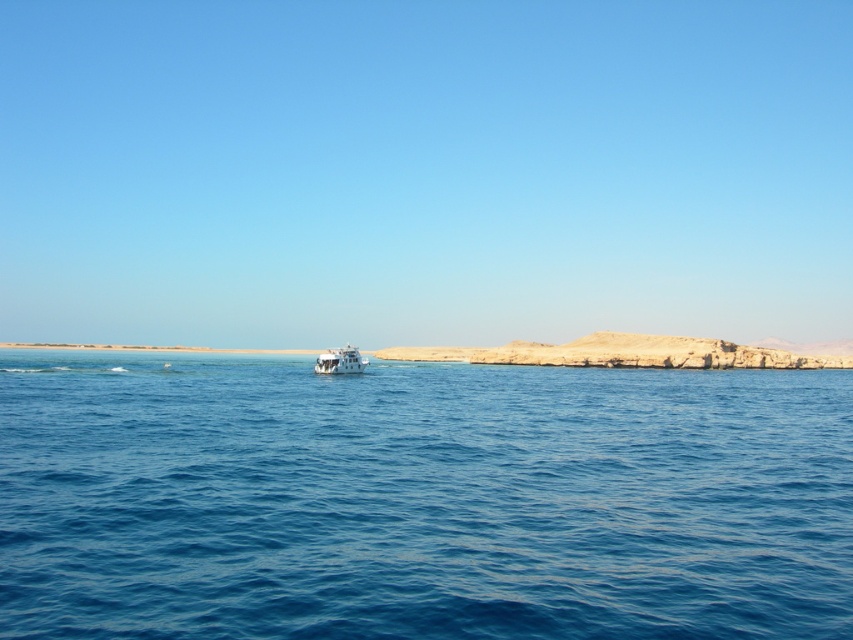
Question: Can you confirm if white rocky coast at center is bigger than white glossy boat at center?

Choices:
 (A) no
 (B) yes

Answer: (B)

Question: Based on their relative distances, which object is farther from the blue water at center?

Choices:
 (A) white glossy boat at center
 (B) white rocky coast at center

Answer: (B)

Question: Is white rocky coast at center smaller than white glossy boat at center?

Choices:
 (A) no
 (B) yes

Answer: (A)

Question: Among these objects, which one is farthest from the camera?

Choices:
 (A) blue water at center
 (B) white glossy boat at center
 (C) white rocky coast at center

Answer: (C)

Question: Which object is the farthest from the white glossy boat at center?

Choices:
 (A) blue water at center
 (B) white rocky coast at center

Answer: (B)

Question: In this image, where is white rocky coast at center located relative to white glossy boat at center?

Choices:
 (A) left
 (B) right

Answer: (B)